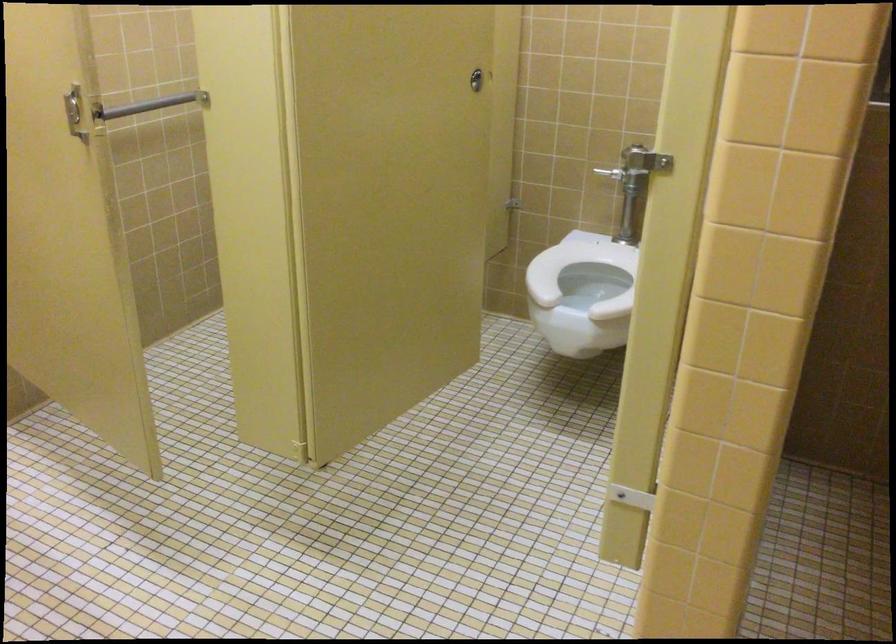
Where is `toilet flush lever`? The height and width of the screenshot is (644, 896). toilet flush lever is located at coordinates (625, 190).